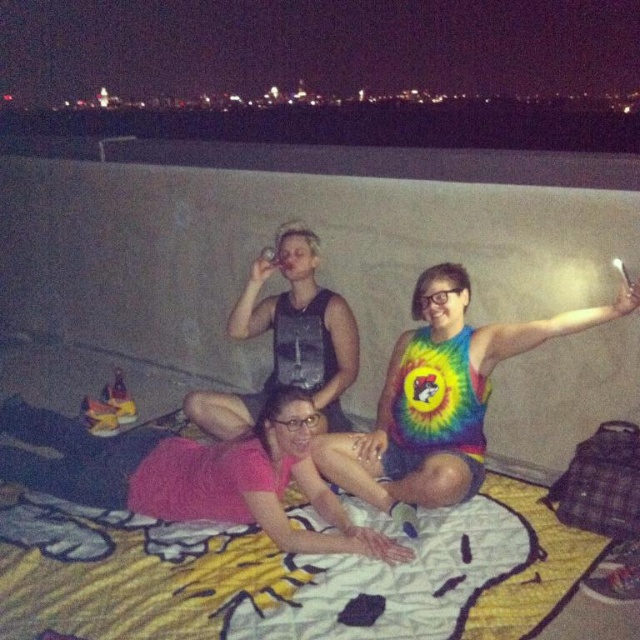
Question: Which object appears farthest from the camera in this image?

Choices:
 (A) pink satin dress at center
 (B) tie-dye fabric tank top at center

Answer: (A)

Question: Does pink satin dress at center have a larger size compared to tie-dye fabric tank top at center?

Choices:
 (A) no
 (B) yes

Answer: (A)

Question: Which point is closer to the camera taking this photo?

Choices:
 (A) 413,452
 (B) 28,467

Answer: (B)

Question: Does pink satin dress at center have a greater width compared to tie-dye fabric tank top at center?

Choices:
 (A) yes
 (B) no

Answer: (A)

Question: Is pink satin dress at center smaller than tie-dye fabric tank top at center?

Choices:
 (A) yes
 (B) no

Answer: (A)